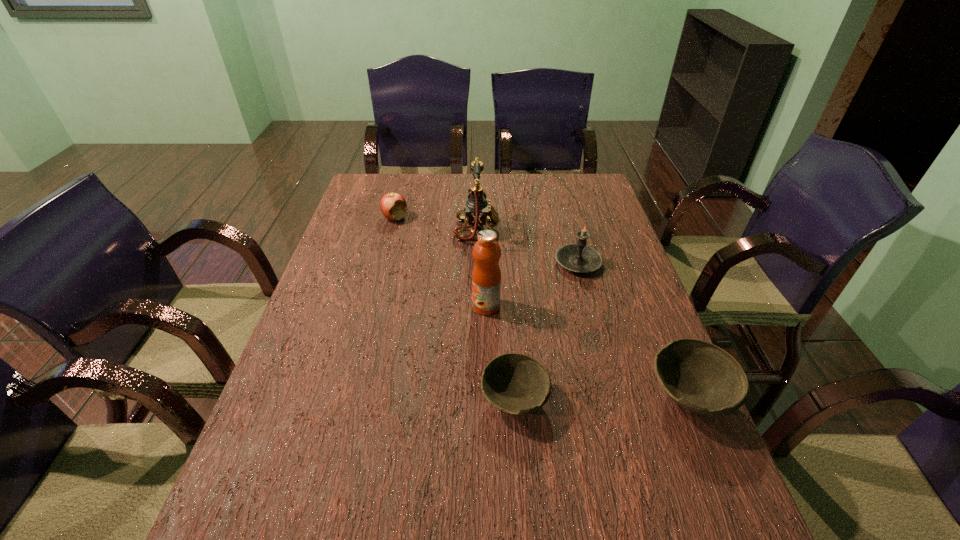
In order to click on unoccupied position between the shorter bowl and the apple in this screenshot , I will do `click(455, 308)`.

Identify the location of vacant region between the candle and the fruit juice. Image resolution: width=960 pixels, height=540 pixels. (532, 285).

Find the location of a particular element. Image resolution: width=960 pixels, height=540 pixels. free space between the second object from right to left and the taller bowl is located at coordinates (635, 329).

I want to click on vacant point located between the telephone and the shortest object, so click(495, 315).

Where is `empty location between the apple and the shortest object`? The image size is (960, 540). empty location between the apple and the shortest object is located at coordinates (455, 308).

At what (x,y) coordinates should I click in order to perform the action: click on object that is the third closest to the leftmost object. Please return your answer as a coordinate pair (x, y). This screenshot has width=960, height=540. Looking at the image, I should click on (579, 257).

Identify which object is the fourth closest to the telephone. Please provide its 2D coordinates. Your answer should be formatted as a tuple, i.e. [(x, y)], where the tuple contains the x and y coordinates of a point satisfying the conditions above.

[(515, 383)]

Where is `free space that satisfies the following two spatial constraints: 1. on the front label of the fruit juice; 2. on the left side of the taller bowl`? The image size is (960, 540). free space that satisfies the following two spatial constraints: 1. on the front label of the fruit juice; 2. on the left side of the taller bowl is located at coordinates (488, 396).

Where is `free space that satisfies the following two spatial constraints: 1. on the back side of the fifth object from left to right; 2. on the front of the telephone, featuring the rotary dial`? free space that satisfies the following two spatial constraints: 1. on the back side of the fifth object from left to right; 2. on the front of the telephone, featuring the rotary dial is located at coordinates (570, 231).

Where is `vacant area in the image that satisfies the following two spatial constraints: 1. on the front of the telephone, featuring the rotary dial; 2. on the left side of the third tallest object`? The width and height of the screenshot is (960, 540). vacant area in the image that satisfies the following two spatial constraints: 1. on the front of the telephone, featuring the rotary dial; 2. on the left side of the third tallest object is located at coordinates (476, 262).